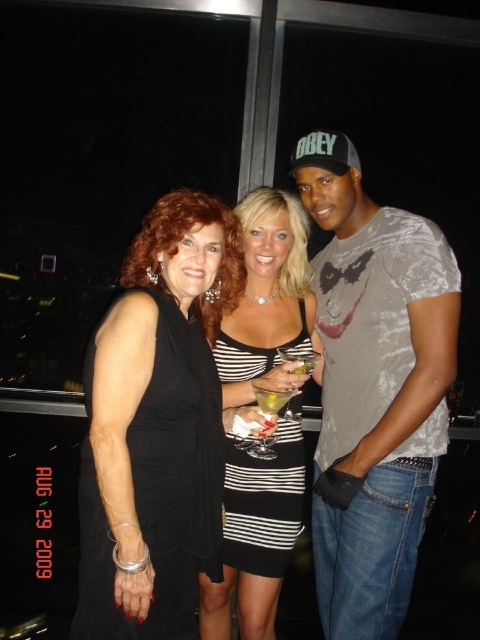
Question: Which point appears closest to the camera in this image?

Choices:
 (A) (235, 564)
 (B) (192, 490)
 (C) (271, 401)
 (D) (337, 451)

Answer: (B)

Question: Does gray printed t-shirt at center have a lesser width compared to striped fabric dress at center?

Choices:
 (A) no
 (B) yes

Answer: (A)

Question: Does black satin dress at center have a lesser width compared to translucent glass drink at center?

Choices:
 (A) no
 (B) yes

Answer: (A)

Question: Which point is closer to the camera?

Choices:
 (A) translucent glass drink at center
 (B) gray printed t-shirt at center
 (C) striped fabric dress at center

Answer: (B)

Question: Based on their relative distances, which object is nearer to the striped fabric dress at center?

Choices:
 (A) translucent glass drink at center
 (B) gray printed t-shirt at center

Answer: (B)

Question: Is striped fabric dress at center wider than translucent glass drink at center?

Choices:
 (A) yes
 (B) no

Answer: (A)